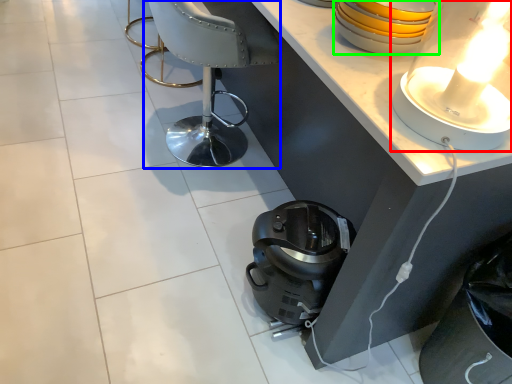
Question: Which object is positioned farthest from lamp (highlighted by a red box)? Select from armchair (highlighted by a blue box) and appliance (highlighted by a green box).

Choices:
 (A) armchair
 (B) appliance

Answer: (A)